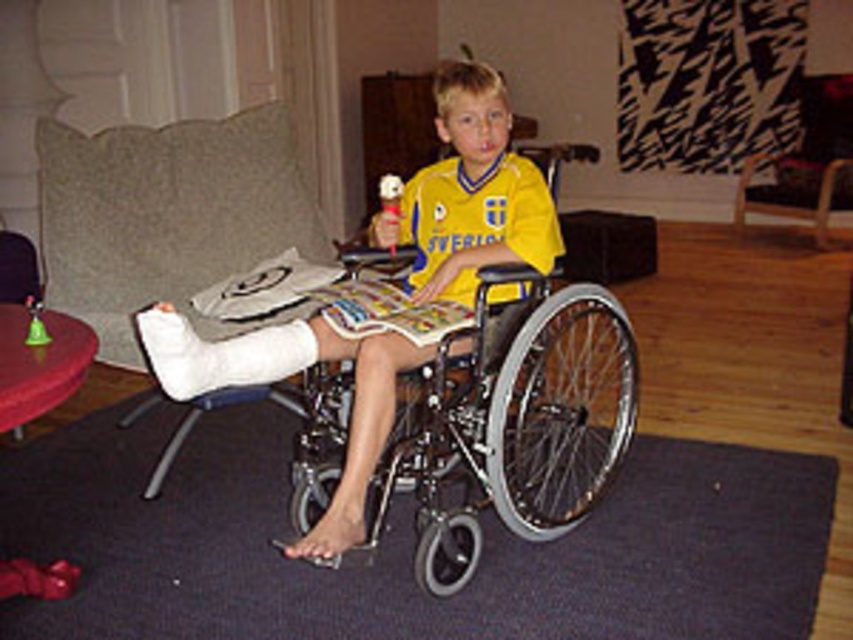
Question: Considering the real-world distances, which object is farthest from the silver metallic wheelchair at center?

Choices:
 (A) metallic wheelchair at center
 (B) brown leather armchair at upper right
 (C) white cast at left
 (D) dark gray carpet at lower center

Answer: (B)

Question: Is metallic wheelchair at center smaller than brown leather armchair at upper right?

Choices:
 (A) yes
 (B) no

Answer: (B)

Question: Which of the following is the farthest from the observer?

Choices:
 (A) click(218, 250)
 (B) click(799, 198)

Answer: (B)

Question: Can you confirm if metallic wheelchair at center is positioned to the right of brown leather armchair at upper right?

Choices:
 (A) no
 (B) yes

Answer: (A)

Question: Is silver metallic wheelchair at center wider than brown leather armchair at upper right?

Choices:
 (A) yes
 (B) no

Answer: (A)

Question: Which of the following is the closest to the observer?

Choices:
 (A) (831, 211)
 (B) (90, 269)
 (C) (679, 476)
 (D) (302, 339)

Answer: (D)